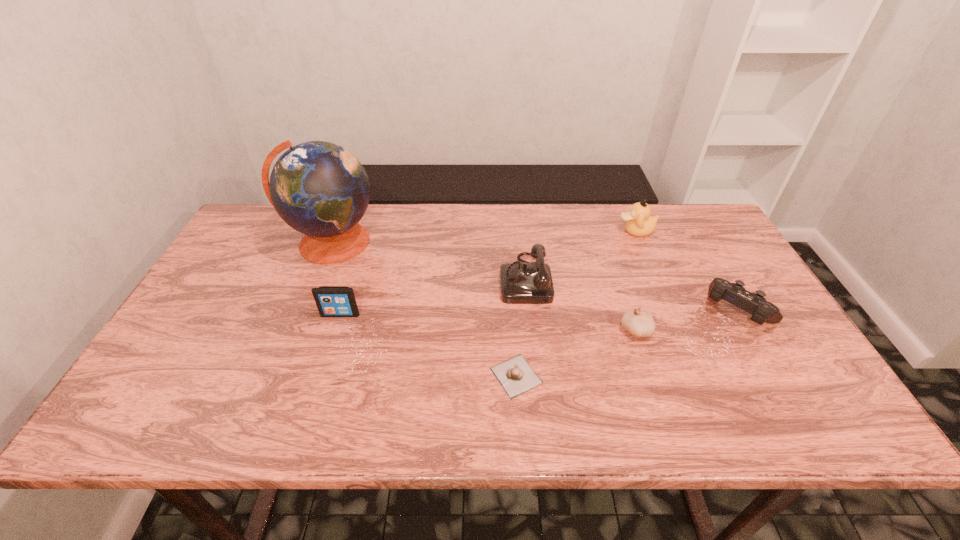
Image resolution: width=960 pixels, height=540 pixels. In the image, there is a desktop. In order to click on free space at the far left corner in this screenshot , I will do `click(278, 245)`.

The width and height of the screenshot is (960, 540). In order to click on free space at the near right corner of the desktop in this screenshot , I will do `click(808, 416)`.

I want to click on free space between the telephone and the nearer garlic, so click(520, 327).

What are the coordinates of `vacant point located between the iPod and the sixth object from left to right` in the screenshot? It's located at (488, 273).

The image size is (960, 540). What are the coordinates of `free area in between the telephone and the right garlic` in the screenshot? It's located at (580, 305).

Where is `free space between the tallest object and the duckling`? The image size is (960, 540). free space between the tallest object and the duckling is located at coordinates (484, 237).

You are a GUI agent. You are given a task and a screenshot of the screen. Output one action in this format:
    pyautogui.click(x=<x>, y=<y>)
    Task: Click on the free point between the telephone and the taller garlic
    
    Given the screenshot: What is the action you would take?
    pyautogui.click(x=580, y=305)

This screenshot has height=540, width=960. I want to click on free space between the iPod and the globe, so click(336, 278).

This screenshot has width=960, height=540. What are the coordinates of `vacant space that is in between the rightmost object and the telephone` in the screenshot? It's located at (631, 295).

Locate an element on the screen. This screenshot has width=960, height=540. free space between the taller garlic and the iPod is located at coordinates (488, 322).